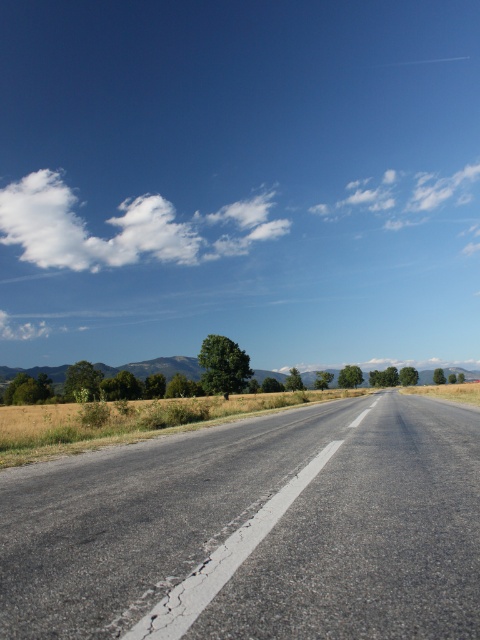
Question: Which object appears closest to the camera in this image?

Choices:
 (A) asphalt road at center
 (B) white fluffy cloud at upper left

Answer: (A)

Question: Can you confirm if asphalt road at center is positioned above white fluffy cloud at upper left?

Choices:
 (A) yes
 (B) no

Answer: (B)

Question: Among these points, which one is farthest from the camera?

Choices:
 (A) (66, 621)
 (B) (147, 202)

Answer: (B)

Question: Can you confirm if asphalt road at center is thinner than white fluffy cloud at upper left?

Choices:
 (A) no
 (B) yes

Answer: (B)

Question: Does asphalt road at center have a smaller size compared to white fluffy cloud at upper left?

Choices:
 (A) yes
 (B) no

Answer: (A)